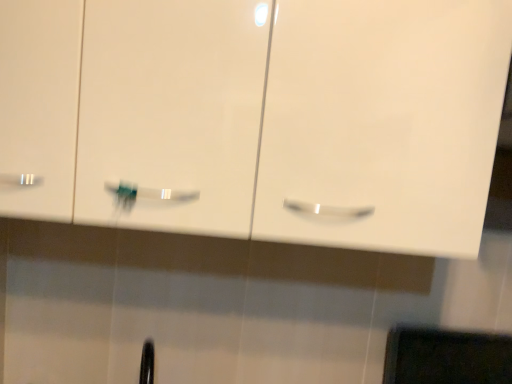
What is the approximate width of white glossy cabinet at center?

The width of white glossy cabinet at center is 14.86 inches.

What do you see at coordinates (257, 117) in the screenshot?
I see `white glossy cabinet at center` at bounding box center [257, 117].

You are a GUI agent. You are given a task and a screenshot of the screen. Output one action in this format:
    pyautogui.click(x=<x>, y=<y>)
    Task: Click on the white glossy cabinet at center
    Image resolution: width=512 pixels, height=384 pixels.
    Given the screenshot: What is the action you would take?
    pyautogui.click(x=257, y=117)

The image size is (512, 384). Identify the location of white glossy cabinet at center. (257, 117).